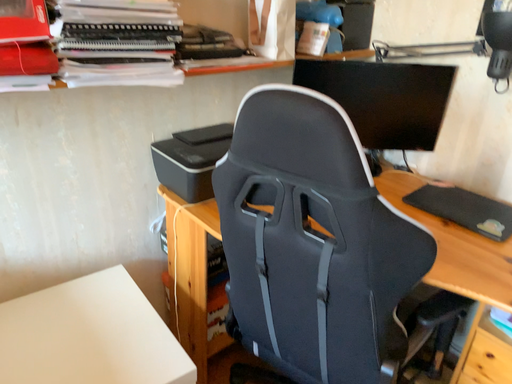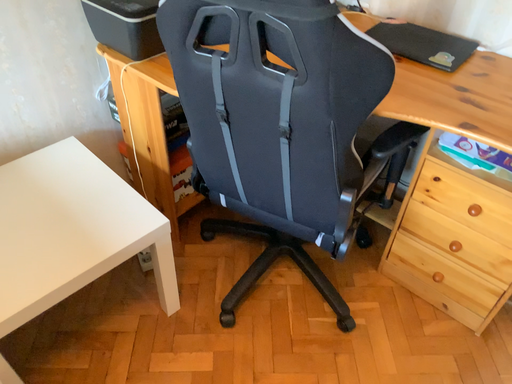
Question: Which way did the camera rotate in the video?

Choices:
 (A) rotated left
 (B) rotated right

Answer: (B)